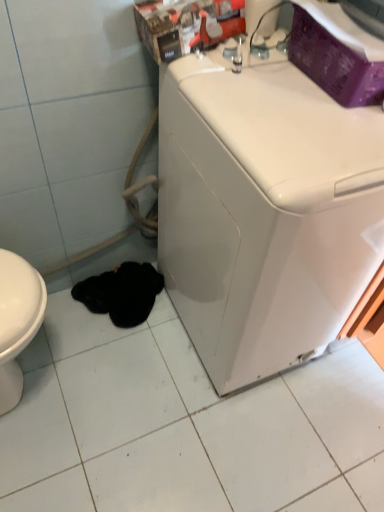
Question: Is point (125, 266) positioned closer to the camera than point (253, 221)?

Choices:
 (A) farther
 (B) closer

Answer: (A)

Question: In the image, is black soft cloth at lower left positioned in front of or behind white glossy washing machine at center?

Choices:
 (A) front
 (B) behind

Answer: (B)

Question: Is black soft cloth at lower left to the left or to the right of white glossy washing machine at center in the image?

Choices:
 (A) left
 (B) right

Answer: (A)

Question: Is point (210, 181) positioned closer to the camera than point (137, 278)?

Choices:
 (A) closer
 (B) farther

Answer: (A)

Question: Looking at the image, does white glossy washing machine at center seem bigger or smaller compared to black soft cloth at lower left?

Choices:
 (A) big
 (B) small

Answer: (A)

Question: Considering the positions of white glossy washing machine at center and black soft cloth at lower left in the image, is white glossy washing machine at center taller or shorter than black soft cloth at lower left?

Choices:
 (A) short
 (B) tall

Answer: (B)

Question: Is white glossy washing machine at center in front of or behind black soft cloth at lower left in the image?

Choices:
 (A) front
 (B) behind

Answer: (A)